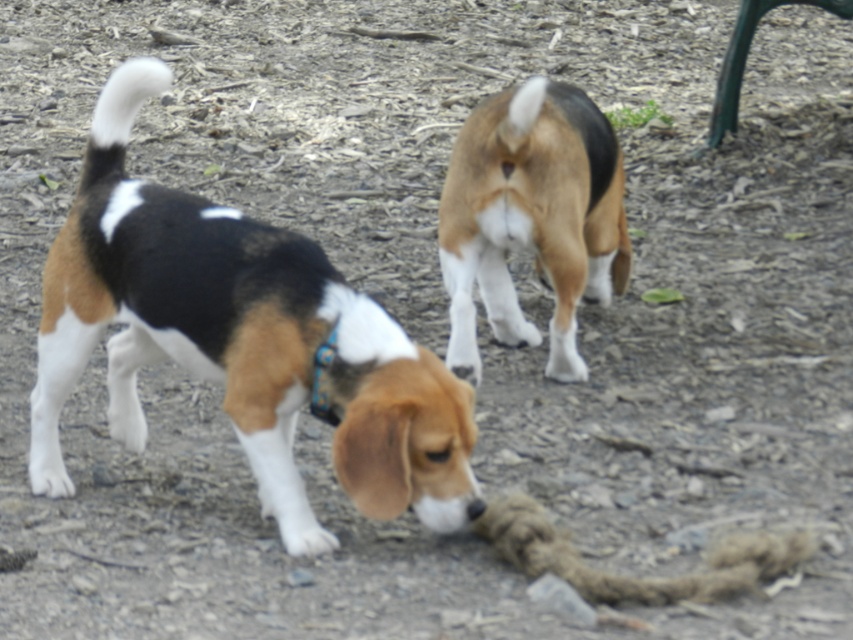
Question: Can you confirm if brown and white fur at center is bigger than blue fabric neckband at lower center?

Choices:
 (A) yes
 (B) no

Answer: (A)

Question: Which point is closer to the camera?

Choices:
 (A) (244, 236)
 (B) (328, 401)

Answer: (B)

Question: Among these objects, which one is farthest from the camera?

Choices:
 (A) blue fabric neckband at lower center
 (B) brown and white fur at center

Answer: (B)

Question: Does brown and white fur at center appear on the right side of blue fabric neckband at lower center?

Choices:
 (A) no
 (B) yes

Answer: (B)

Question: Which object is the farthest from the blue fabric neckband at lower center?

Choices:
 (A) tri-color fur beagle at lower left
 (B) brown and white fur at center

Answer: (B)

Question: Is brown and white fur at center bigger than blue fabric neckband at lower center?

Choices:
 (A) no
 (B) yes

Answer: (B)